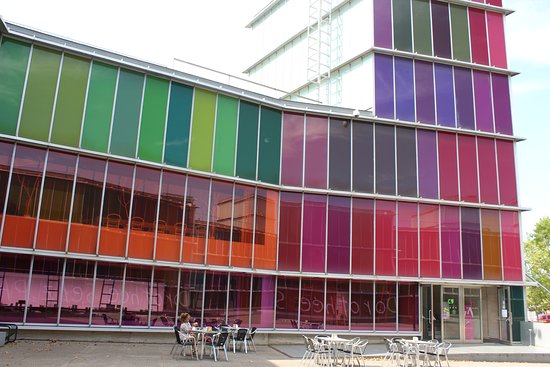
The width and height of the screenshot is (550, 367). Find the location of `ladders`. ladders is located at coordinates (108, 286), (158, 302), (51, 293).